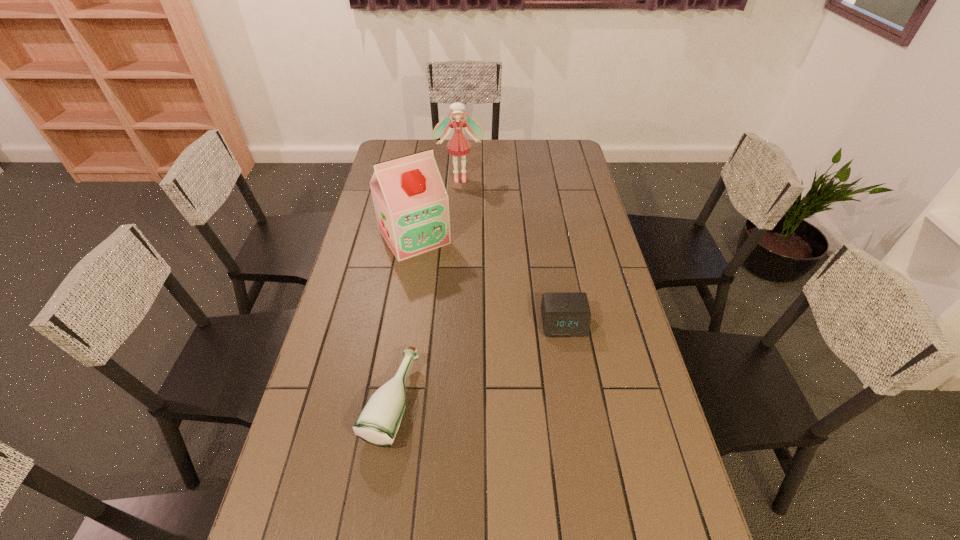
Locate an element on the screen. The width and height of the screenshot is (960, 540). bottle is located at coordinates pos(378,423).

Identify the location of the shortest object. This screenshot has width=960, height=540. (564, 314).

Locate an element on the screen. The image size is (960, 540). the second nearest object is located at coordinates (564, 314).

Locate an element on the screen. This screenshot has height=540, width=960. soya milk is located at coordinates (411, 203).

I want to click on doll, so click(458, 145).

Find the location of a particular element. The image size is (960, 540). vacant space located 0.340m on the right of the bottle is located at coordinates [546, 402].

Where is `vacant space located 0.270m on the front-facing side of the shortest object`? The height and width of the screenshot is (540, 960). vacant space located 0.270m on the front-facing side of the shortest object is located at coordinates (581, 424).

Locate an element on the screen. This screenshot has width=960, height=540. free space located 0.300m with the cap open on the soya milk is located at coordinates (469, 316).

This screenshot has height=540, width=960. What are the coordinates of `free space located with the cap open on the soya milk` in the screenshot? It's located at (454, 293).

Locate an element on the screen. The image size is (960, 540). vacant space located with the cap open on the soya milk is located at coordinates (482, 334).